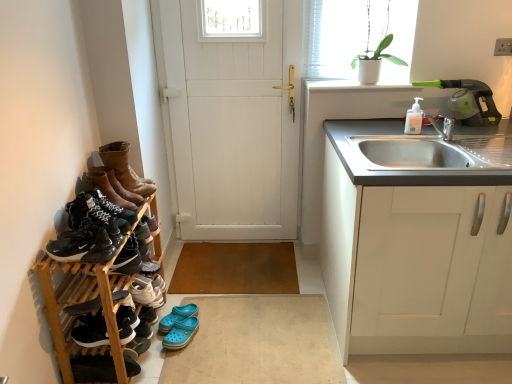
Question: Is point (404, 84) closer or farther from the camera than point (214, 124)?

Choices:
 (A) closer
 (B) farther

Answer: (A)

Question: Based on their sizes in the image, would you say white smooth window sill at upper right is bigger or smaller than white wooden door at center?

Choices:
 (A) big
 (B) small

Answer: (B)

Question: Which is nearer to the shiny black sneakers at left, the seventh footwear positioned from the bottom?

Choices:
 (A) black suede sneakers at lower left, which ranks as the 5th footwear in bottom-to-top order
 (B) white plastic soap dispenser at upper right
 (C) white smooth window sill at upper right
 (D) green plastic vacuum cleaner at upper right
 (E) black matte sneakers at left, arranged as the 1th shoe when viewed from the top

Answer: (E)

Question: Which of these objects is positioned closest to the black matte sneakers at left, arranged as the 1th shoe when viewed from the top?

Choices:
 (A) blue rubber clogs at lower center, arranged as the third footwear when ordered from the bottom
 (B) black suede sneakers at lower left, which ranks as the 7th footwear in top-to-bottom order
 (C) white plastic soap dispenser at upper right
 (D) white matte cabinet at right
 (E) white ceramic plant at upper right

Answer: (B)